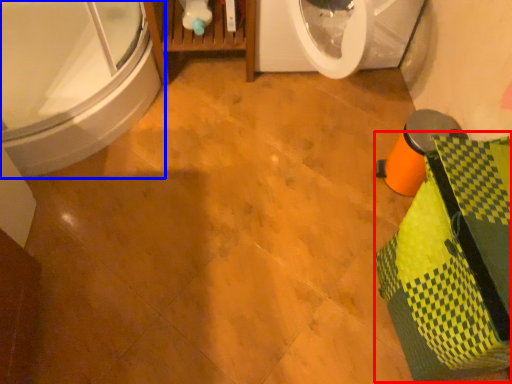
Question: Which of the following is the closest to the observer, material (highlighted by a red box) or bathtub (highlighted by a blue box)?

Choices:
 (A) material
 (B) bathtub

Answer: (A)